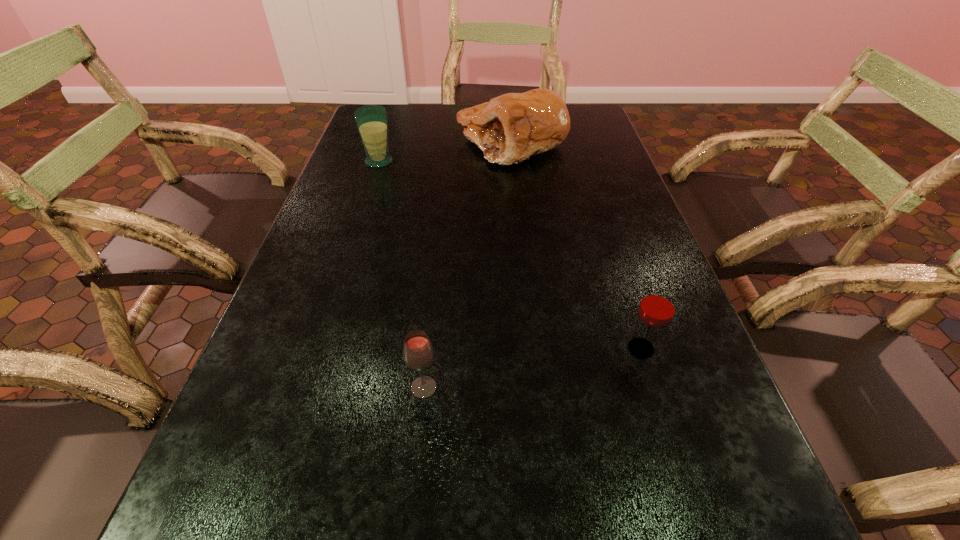
Find the location of `free region at the right edge of the desktop`. free region at the right edge of the desktop is located at coordinates (651, 250).

Locate an element on the screen. blank region between the second nearest glass drink container and the second glass drink container from right to left is located at coordinates (533, 368).

Locate an element on the screen. This screenshot has height=540, width=960. vacant space in between the bread and the farthest glass drink container is located at coordinates (445, 152).

The height and width of the screenshot is (540, 960). I want to click on empty space between the nearest glass drink container and the leftmost object, so click(401, 275).

Identify the location of free space between the farthest glass drink container and the rightmost glass drink container. Image resolution: width=960 pixels, height=540 pixels. (510, 255).

The width and height of the screenshot is (960, 540). I want to click on free space between the bread and the leftmost glass drink container, so click(x=445, y=152).

I want to click on unoccupied position between the farthest glass drink container and the bread, so click(445, 152).

Identify the location of free spot between the second nearest glass drink container and the nearest object. The width and height of the screenshot is (960, 540). (533, 368).

The width and height of the screenshot is (960, 540). In order to click on free space between the leftmost object and the bread in this screenshot , I will do `click(445, 152)`.

At what (x,y) coordinates should I click in order to perform the action: click on vacant space that's between the bread and the leftmost glass drink container. Please return your answer as a coordinate pair (x, y). Looking at the image, I should click on (445, 152).